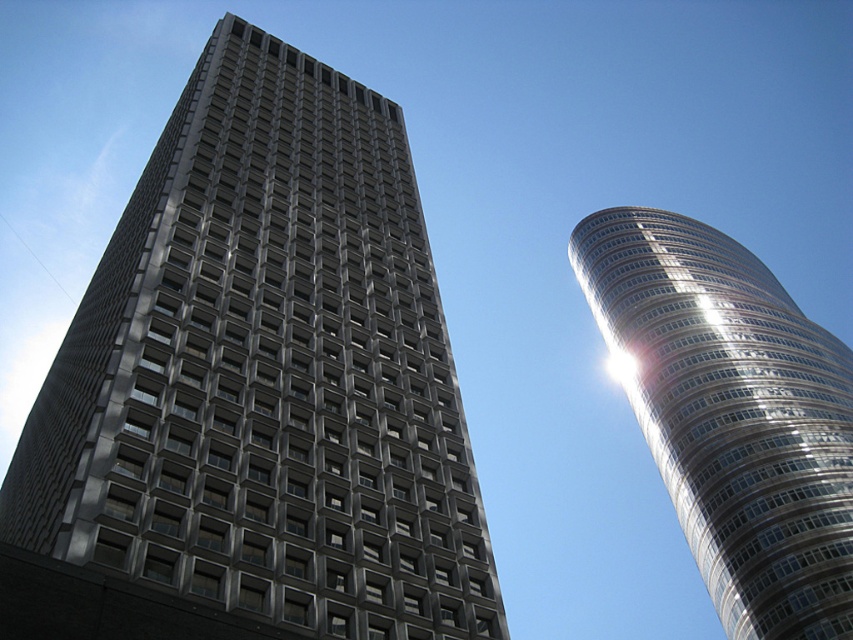
Does matte gray building at center have a larger size compared to shiny silver tower at right?

Incorrect, matte gray building at center is not larger than shiny silver tower at right.

Is point (318, 337) positioned before point (683, 477)?

Yes, it is.

Locate an element on the screen. Image resolution: width=853 pixels, height=640 pixels. matte gray building at center is located at coordinates (265, 372).